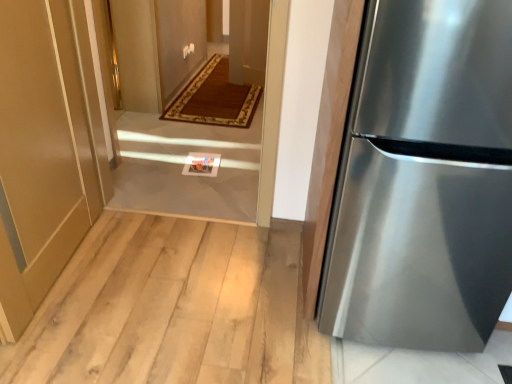
Question: Could you tell me if stainless steel refrigerator at right is facing white tile floor at center?

Choices:
 (A) no
 (B) yes

Answer: (A)

Question: Is stainless steel refrigerator at right bigger than white tile floor at center?

Choices:
 (A) yes
 (B) no

Answer: (A)

Question: From a real-world perspective, is stainless steel refrigerator at right on white tile floor at center?

Choices:
 (A) no
 (B) yes

Answer: (B)

Question: From a real-world perspective, is stainless steel refrigerator at right below white tile floor at center?

Choices:
 (A) yes
 (B) no

Answer: (B)

Question: Is stainless steel refrigerator at right with white tile floor at center?

Choices:
 (A) yes
 (B) no

Answer: (B)

Question: From a real-world perspective, is stainless steel refrigerator at right above or below matte gold door at lower left?

Choices:
 (A) above
 (B) below

Answer: (A)

Question: Is stainless steel refrigerator at right taller or shorter than matte gold door at lower left?

Choices:
 (A) short
 (B) tall

Answer: (B)

Question: In the image, is stainless steel refrigerator at right positioned in front of or behind matte gold door at lower left?

Choices:
 (A) front
 (B) behind

Answer: (A)

Question: Is stainless steel refrigerator at right inside or outside of matte gold door at lower left?

Choices:
 (A) outside
 (B) inside

Answer: (A)

Question: In terms of size, does white tile floor at center appear bigger or smaller than matte gold door at lower left?

Choices:
 (A) big
 (B) small

Answer: (B)

Question: Considering the positions of point (154, 117) and point (72, 119), is point (154, 117) closer or farther from the camera than point (72, 119)?

Choices:
 (A) farther
 (B) closer

Answer: (A)

Question: From the image's perspective, is white tile floor at center located above or below matte gold door at lower left?

Choices:
 (A) below
 (B) above

Answer: (B)

Question: Is white tile floor at center in front of or behind matte gold door at lower left in the image?

Choices:
 (A) behind
 (B) front

Answer: (A)

Question: Considering the positions of point (219, 210) and point (373, 284), is point (219, 210) closer or farther from the camera than point (373, 284)?

Choices:
 (A) closer
 (B) farther

Answer: (B)

Question: In terms of size, does white tile floor at center appear bigger or smaller than stainless steel refrigerator at right?

Choices:
 (A) big
 (B) small

Answer: (B)